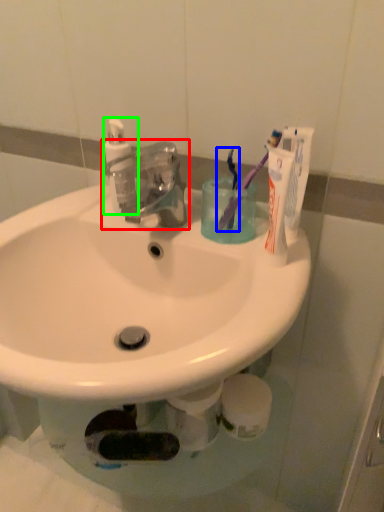
Question: Estimate the real-world distances between objects in this image. Which object is closer to tap (highlighted by a red box), toothbrush (highlighted by a blue box) or soap dispenser (highlighted by a green box)?

Choices:
 (A) toothbrush
 (B) soap dispenser

Answer: (B)